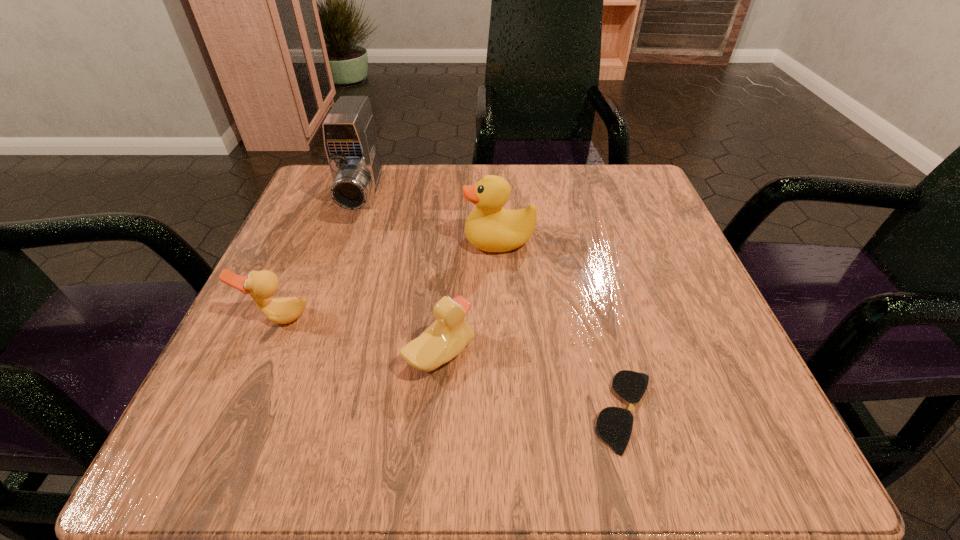
Locate which object ranks third in proximity to the rightmost object. Please provide its 2D coordinates. Your answer should be formatted as a tuple, i.e. [(x, y)], where the tuple contains the x and y coordinates of a point satisfying the conditions above.

[(261, 285)]

Locate an element on the screen. The height and width of the screenshot is (540, 960). object that is the third closest to the leftmost duck is located at coordinates (489, 227).

This screenshot has width=960, height=540. In order to click on the third closest duck to the tallest object in this screenshot , I will do pyautogui.click(x=445, y=338).

Identify which duck is located as the second nearest to the leftmost duck. Please provide its 2D coordinates. Your answer should be formatted as a tuple, i.e. [(x, y)], where the tuple contains the x and y coordinates of a point satisfying the conditions above.

[(489, 227)]

Locate an element on the screen. free location that satisfies the following two spatial constraints: 1. on the back side of the spectacles; 2. at the beak of the second tallest object is located at coordinates [x=582, y=241].

The width and height of the screenshot is (960, 540). Find the location of `free space in the image that satisfies the following two spatial constraints: 1. on the beak of the leftmost duck; 2. on the right side of the shortest object`. free space in the image that satisfies the following two spatial constraints: 1. on the beak of the leftmost duck; 2. on the right side of the shortest object is located at coordinates (238, 411).

Where is `vacant position in the image that satisfies the following two spatial constraints: 1. at the beak of the tallest duck; 2. on the left side of the spectacles`? The height and width of the screenshot is (540, 960). vacant position in the image that satisfies the following two spatial constraints: 1. at the beak of the tallest duck; 2. on the left side of the spectacles is located at coordinates (508, 411).

At what (x,y) coordinates should I click in order to perform the action: click on vacant area that satisfies the following two spatial constraints: 1. at the beak of the farthest duck; 2. on the right side of the rightmost object. Please return your answer as a coordinate pair (x, y). The height and width of the screenshot is (540, 960). Looking at the image, I should click on (508, 411).

Locate an element on the screen. vacant space that satisfies the following two spatial constraints: 1. at the beak of the tallest duck; 2. on the beak of the leftmost duck is located at coordinates (503, 318).

Where is `vacant region that satisfies the following two spatial constraints: 1. at the beak of the second tallest object; 2. on the beak of the leftmost duck`? The width and height of the screenshot is (960, 540). vacant region that satisfies the following two spatial constraints: 1. at the beak of the second tallest object; 2. on the beak of the leftmost duck is located at coordinates (503, 318).